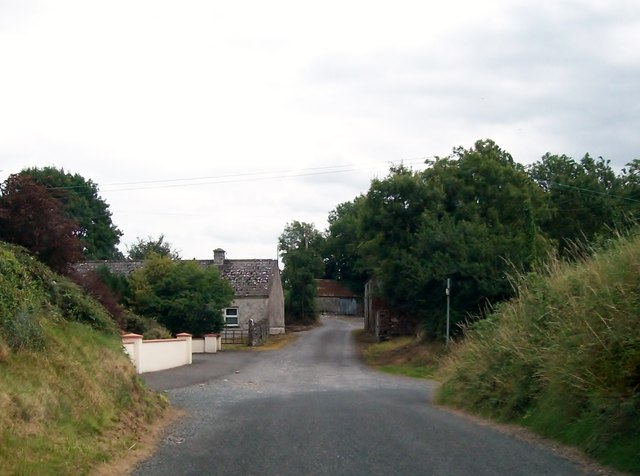
I want to click on chimney, so click(x=223, y=255).